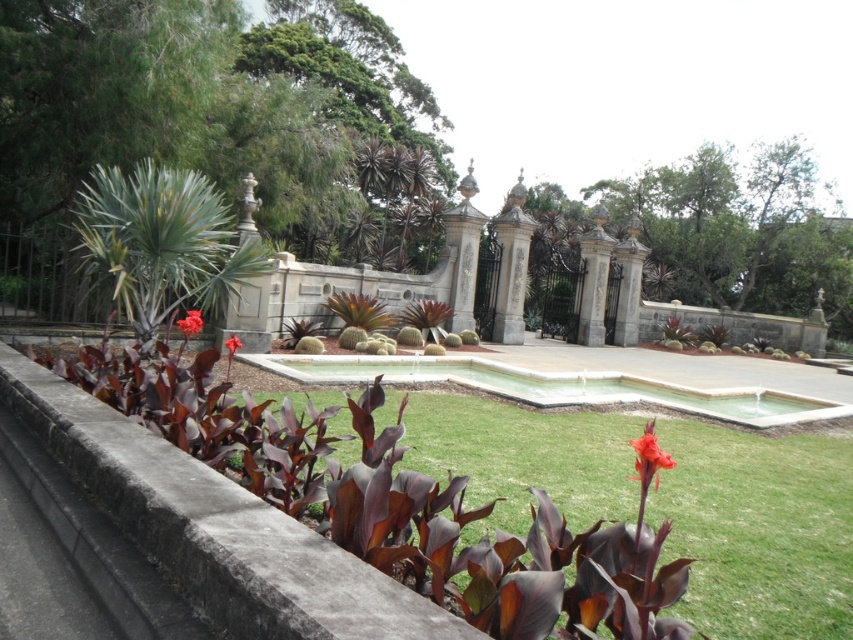
Between gray concrete ledge at lower left and white concrete pool at center, which one appears on the right side from the viewer's perspective?

From the viewer's perspective, white concrete pool at center appears more on the right side.

From the picture: Can you confirm if gray concrete ledge at lower left is positioned to the right of white concrete pool at center?

In fact, gray concrete ledge at lower left is to the left of white concrete pool at center.

Who is more distant from viewer, [22,419] or [430,378]?

Positioned behind is point [430,378].

This screenshot has height=640, width=853. In order to click on gray concrete ledge at lower left in this screenshot , I will do `click(216, 528)`.

Between gray concrete ledge at lower left and bright orange flower at center, which one appears on the right side from the viewer's perspective?

bright orange flower at center is more to the right.

Does gray concrete ledge at lower left have a greater width compared to bright orange flower at center?

Yes, gray concrete ledge at lower left is wider than bright orange flower at center.

This screenshot has width=853, height=640. Find the location of `gray concrete ledge at lower left`. gray concrete ledge at lower left is located at coordinates (216, 528).

Does white concrete pool at center come behind purple matte flower at lower left?

Yes, white concrete pool at center is further from the viewer.

Between white concrete pool at center and purple matte flower at lower left, which one is positioned higher?

purple matte flower at lower left

Image resolution: width=853 pixels, height=640 pixels. I want to click on white concrete pool at center, so click(556, 387).

Identify the location of white concrete pool at center. (556, 387).